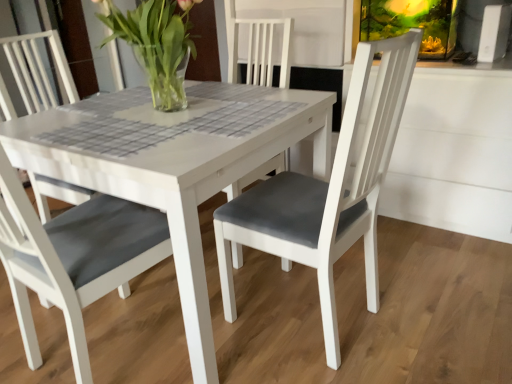
Identify the location of vacant area on top of matte gray cushion at center (from a real-world perspective). (175, 115).